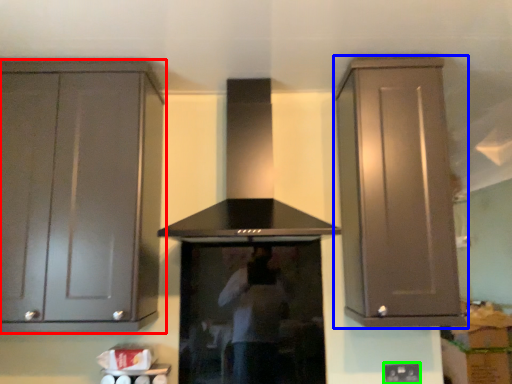
Question: Which object is positioned closest to cabinetry (highlighted by a red box)? Select from cabinetry (highlighted by a blue box) and electric outlet (highlighted by a green box).

Choices:
 (A) cabinetry
 (B) electric outlet

Answer: (A)